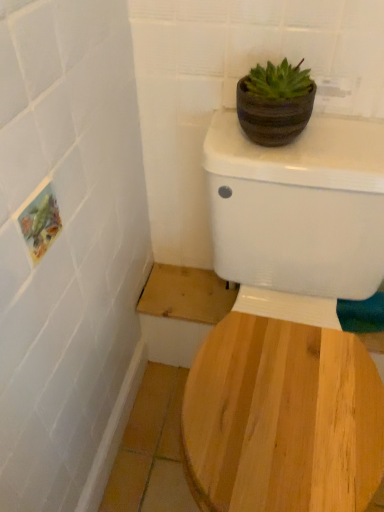
Locate an element on the screen. The width and height of the screenshot is (384, 512). vacant area that is situated to the right of brown striped pot at upper right is located at coordinates (344, 140).